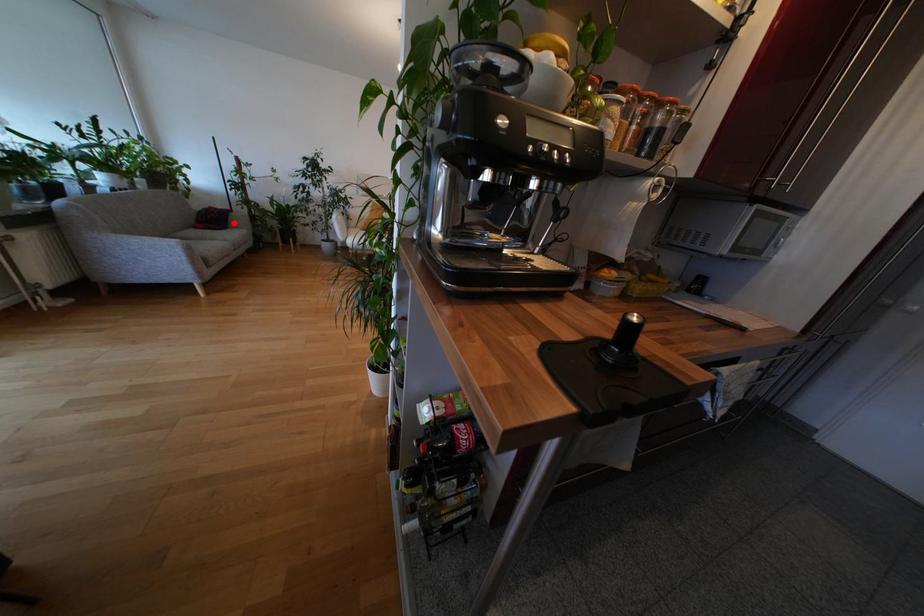
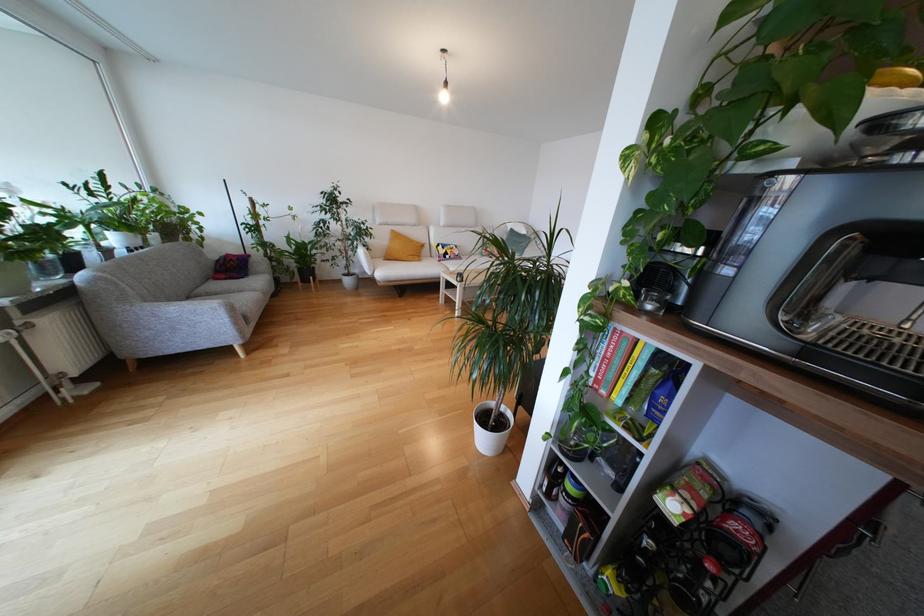
The point at the highlighted location is marked in the first image. Where is the corresponding point in the second image?

(253, 268)